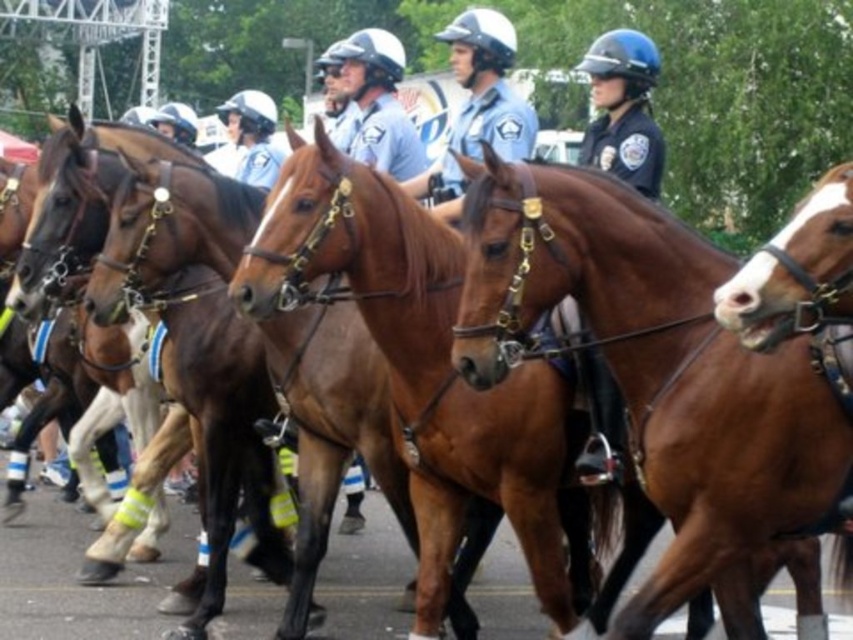
Is matte blue uniform at center thinner than glossy blue helmet at center?

Incorrect, matte blue uniform at center's width is not less than glossy blue helmet at center's.

Who is more distant from viewer, (428, 179) or (370, 115)?

The point (370, 115) is more distant.

Find the location of `matte blue uniform at center`. matte blue uniform at center is located at coordinates (479, 102).